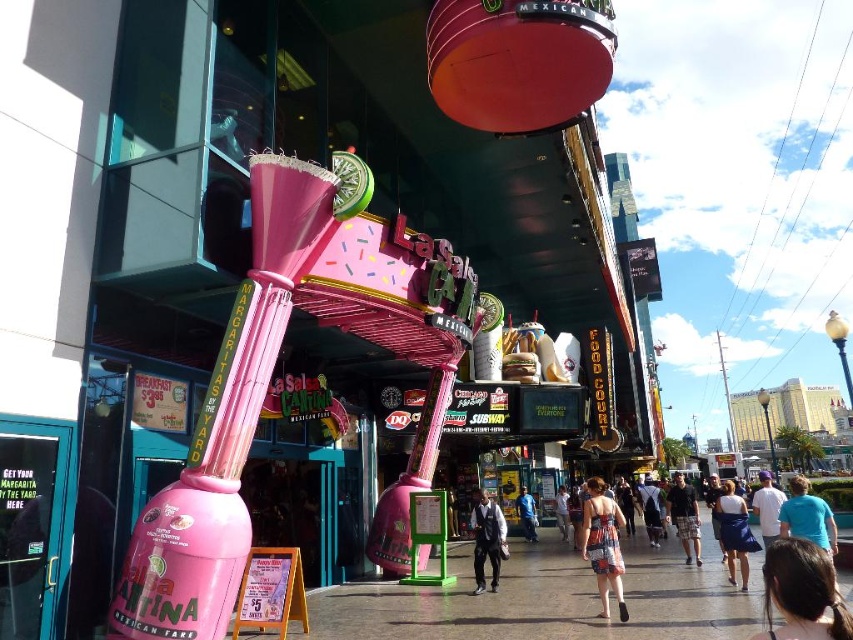
Who is lower down, blue cotton shirt at center or white cotton shirt at lower right?

white cotton shirt at lower right is lower down.

Is blue cotton shirt at center positioned behind white cotton shirt at lower right?

That is False.

The height and width of the screenshot is (640, 853). Identify the location of blue cotton shirt at center. pyautogui.click(x=807, y=516).

Between dark brown hair at lower right and denim shorts at center, which one is positioned lower?

denim shorts at center is below.

Is dark brown hair at lower right positioned before denim shorts at center?

Yes, dark brown hair at lower right is in front of denim shorts at center.

Does point (804, 628) come farther from viewer compared to point (564, 502)?

No, it is in front of (564, 502).

Locate an element on the screen. dark brown hair at lower right is located at coordinates (802, 593).

Which of these two, printed cotton dress at center or blue cotton shirt at center, stands taller?

Standing taller between the two is blue cotton shirt at center.

Is printed cotton dress at center bigger than blue cotton shirt at center?

No, printed cotton dress at center is not bigger than blue cotton shirt at center.

Find the location of `printed cotton dress at center`. printed cotton dress at center is located at coordinates (602, 545).